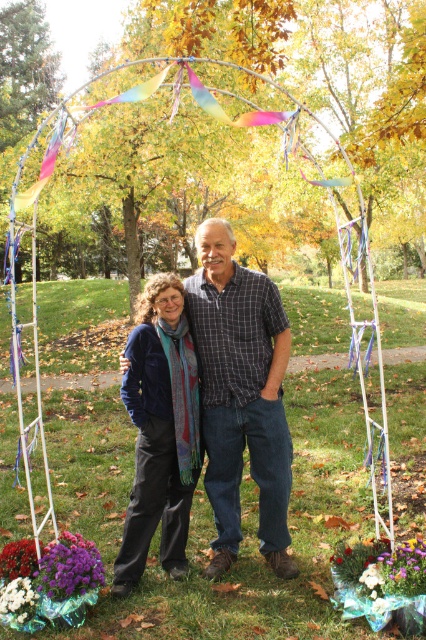
Is white fluffy flowers at lower left above purple fabric flowers at lower left?

No.

Identify the location of white fluffy flowers at lower left. (19, 600).

Can you confirm if dark blue jeans at center is thinner than white fluffy flowers at lower left?

In fact, dark blue jeans at center might be wider than white fluffy flowers at lower left.

Does dark blue jeans at center have a lesser height compared to white fluffy flowers at lower left?

No, dark blue jeans at center is not shorter than white fluffy flowers at lower left.

Between point (273, 483) and point (17, 588), which one is positioned in front?

Positioned in front is point (17, 588).

Locate an element on the screen. The width and height of the screenshot is (426, 640). dark blue jeans at center is located at coordinates (241, 394).

Does dark blue jeans at center have a larger size compared to velvet blue scarf at center?

Incorrect, dark blue jeans at center is not larger than velvet blue scarf at center.

Is dark blue jeans at center wider than velvet blue scarf at center?

Yes, dark blue jeans at center is wider than velvet blue scarf at center.

Does point (264, 388) come behind point (132, 394)?

No, it is not.

Find the location of a particular element. dark blue jeans at center is located at coordinates (241, 394).